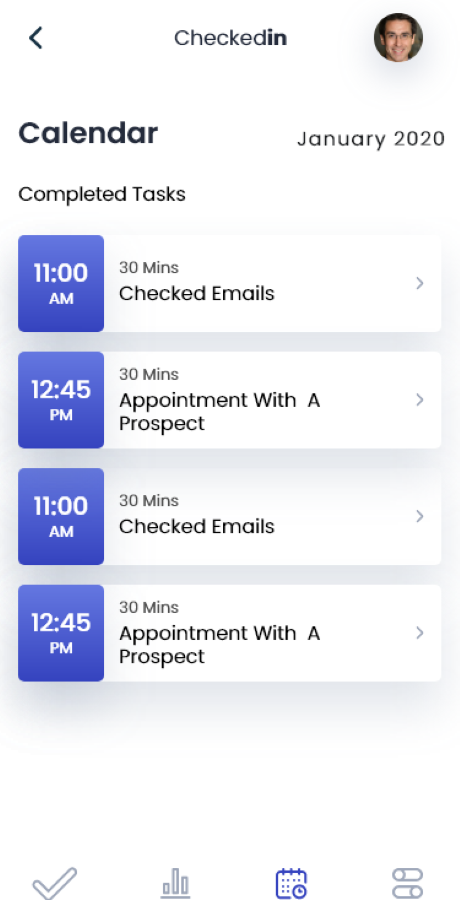
This screenshot has width=460, height=900. I want to click on calendar, so click(x=87, y=126).